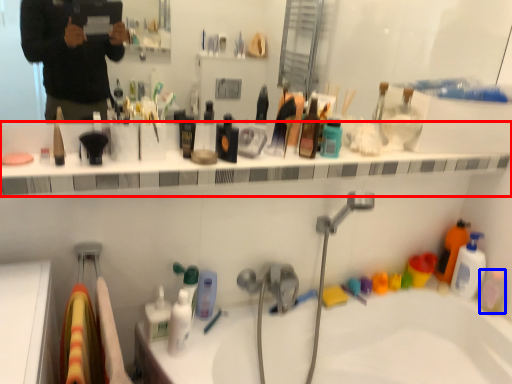
Question: Among these objects, which one is farthest to the camera, ledge (highlighted by a red box) or mouthwash (highlighted by a blue box)?

Choices:
 (A) ledge
 (B) mouthwash

Answer: (B)